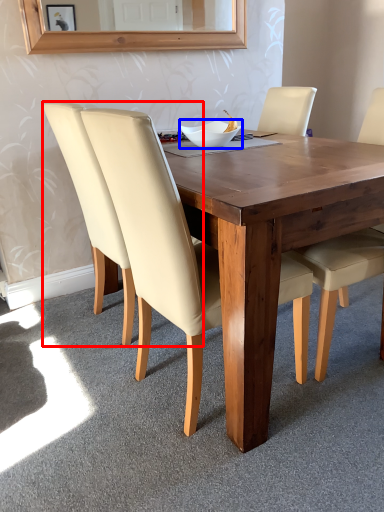
Question: Which object appears closest to the camera in this image, chair (highlighted by a red box) or bowl (highlighted by a blue box)?

Choices:
 (A) chair
 (B) bowl

Answer: (A)